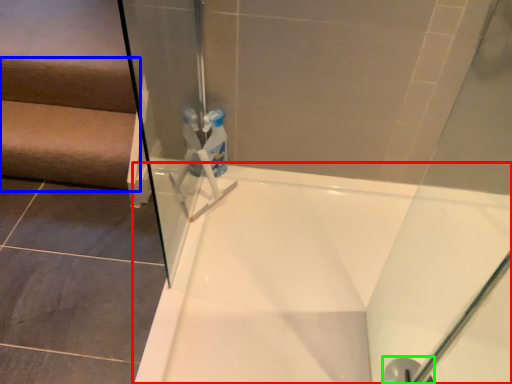
Question: Based on their relative distances, which object is nearer to bathtub (highlighted by a red box)? Choose from stairwell (highlighted by a blue box) and shower (highlighted by a green box).

Choices:
 (A) stairwell
 (B) shower

Answer: (B)